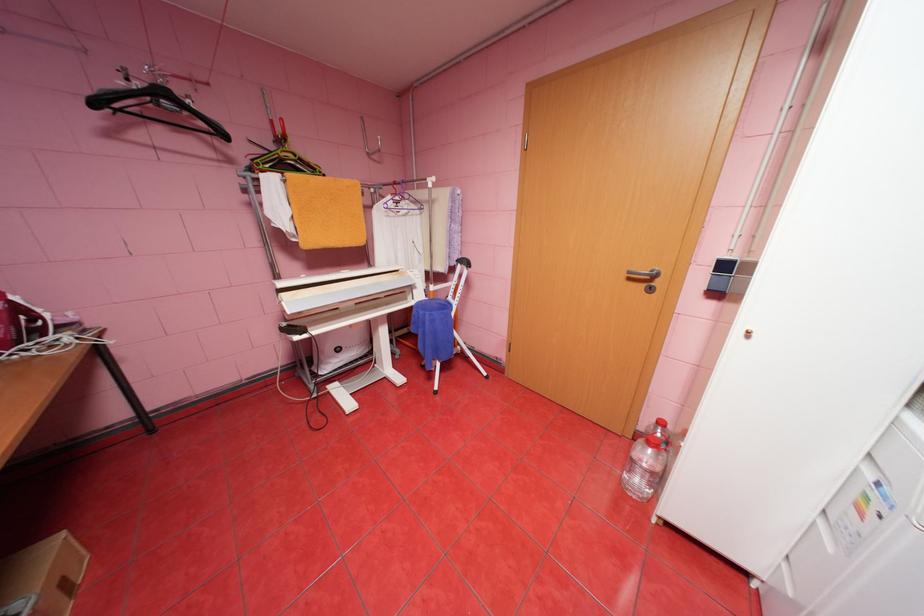
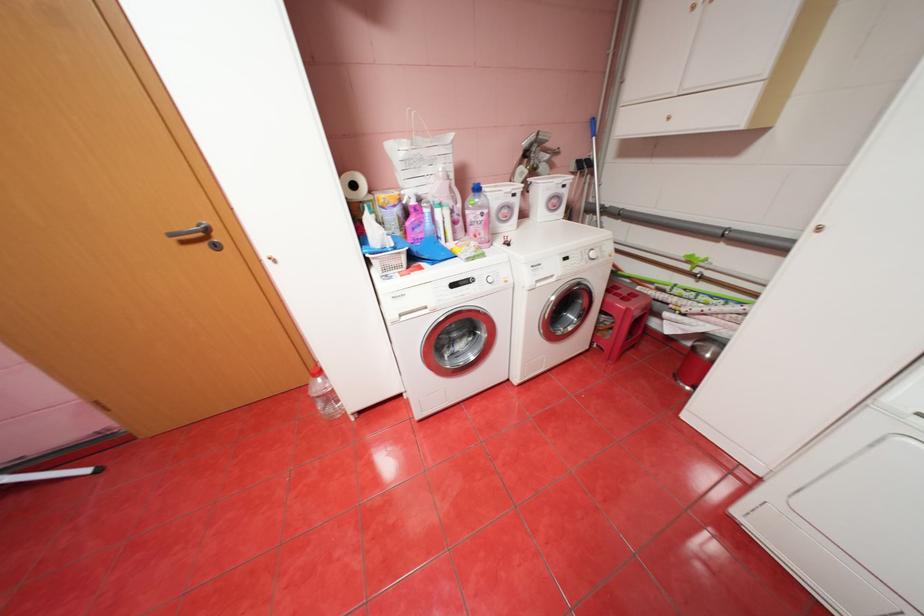
Where in the second image is the point corresponding to pixel 653 455 from the first image?

(329, 385)